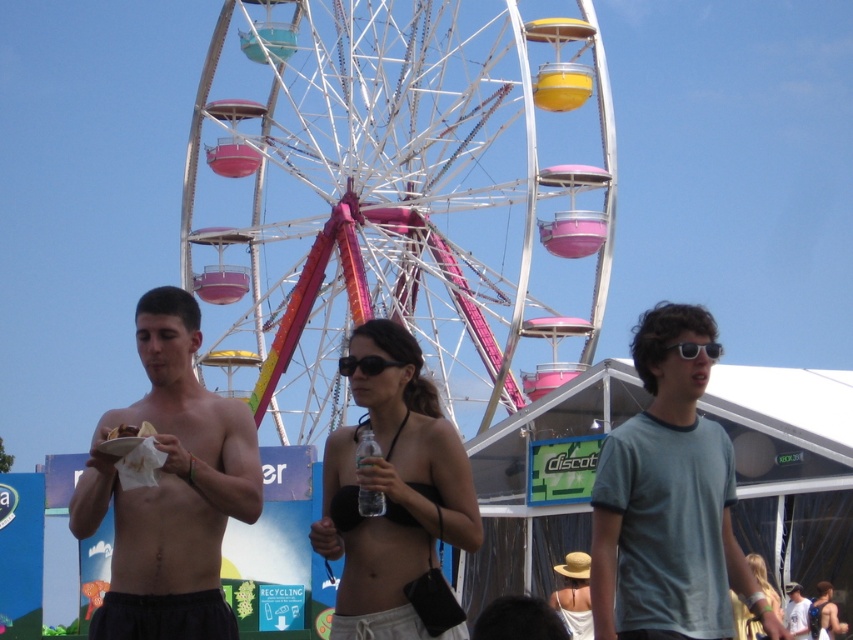
Question: Estimate the real-world distances between objects in this image. Which object is farther from the metallic ferris wheel at center?

Choices:
 (A) sunglasses at center
 (B) gray cotton t-shirt at center
 (C) white cotton t-shirt at center
 (D) black plastic sunglasses at center

Answer: (C)

Question: Can you confirm if gray cotton t-shirt at center is positioned to the left of black plastic sunglasses at center?

Choices:
 (A) yes
 (B) no

Answer: (B)

Question: Observing the image, what is the correct spatial positioning of metallic ferris wheel at center in reference to shiny black skin at center?

Choices:
 (A) below
 (B) above

Answer: (B)

Question: Which object is closer to the camera taking this photo?

Choices:
 (A) clear plastic bottle at center
 (B) sunglasses at center

Answer: (A)

Question: Is shiny black skin at center closer to the viewer compared to clear plastic bottle at center?

Choices:
 (A) yes
 (B) no

Answer: (A)

Question: Which object is positioned farthest from the black plastic sunglasses at center?

Choices:
 (A) gray cotton t-shirt at center
 (B) white cotton t-shirt at center
 (C) clear plastic bottle at center

Answer: (B)